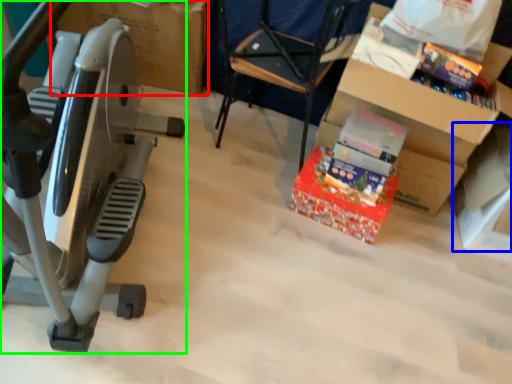
Question: Estimate the real-world distances between objects in this image. Which object is farther from cardboard box (highlighted by a red box), box (highlighted by a blue box) or stationary bicycle (highlighted by a green box)?

Choices:
 (A) box
 (B) stationary bicycle

Answer: (A)